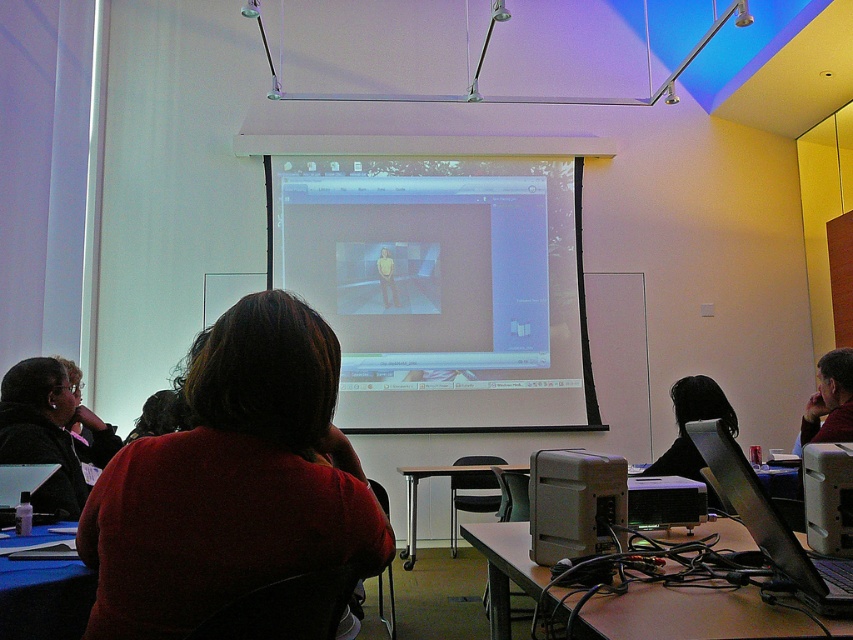
Question: Considering the real-world distances, which object is closest to the wooden desk at center?

Choices:
 (A) black plastic laptop at lower right
 (B) wooden table at lower center
 (C) matte black projector at center

Answer: (C)

Question: Is dark red sweater at center to the left of blue fabric table at lower left from the viewer's perspective?

Choices:
 (A) no
 (B) yes

Answer: (A)

Question: Which object is farther from the camera taking this photo?

Choices:
 (A) metallic silver table at center
 (B) dark red sweater at center
 (C) white glossy projection screen at center
 (D) blue fabric table at lower left

Answer: (C)

Question: Does wooden table at lower center appear on the left side of matte black laptop at upper right?

Choices:
 (A) no
 (B) yes

Answer: (B)

Question: Does blue fabric table at lower left appear under matte black laptop at lower left?

Choices:
 (A) no
 (B) yes

Answer: (B)

Question: Among these points, which one is farthest from the camera?

Choices:
 (A) (848, 435)
 (B) (773, 518)
 (C) (305, 268)
 (D) (32, 484)

Answer: (C)